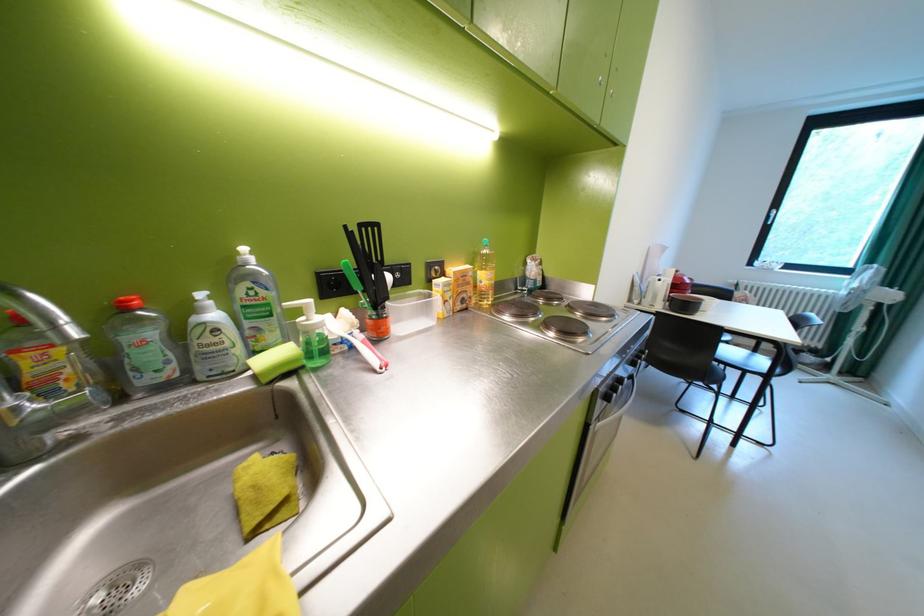
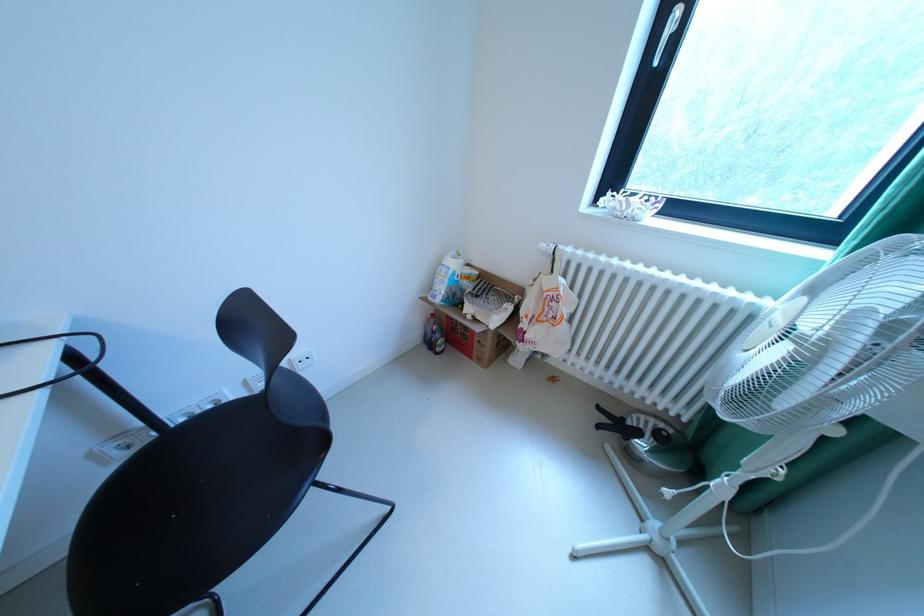
Locate, in the second image, the point that corresponds to the point at 739,282 in the first image.

(553, 246)